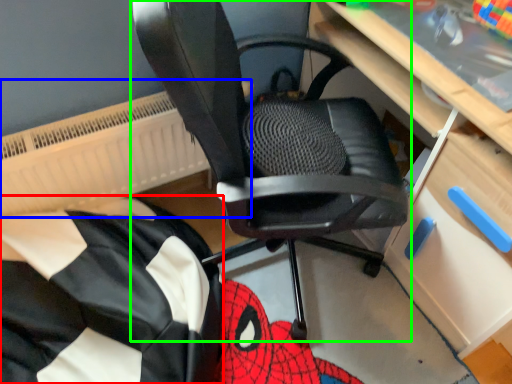
Question: Estimate the real-world distances between objects in this image. Which object is farther from bean bag chair (highlighted by a red box), radiator (highlighted by a blue box) or chair (highlighted by a green box)?

Choices:
 (A) radiator
 (B) chair

Answer: (B)